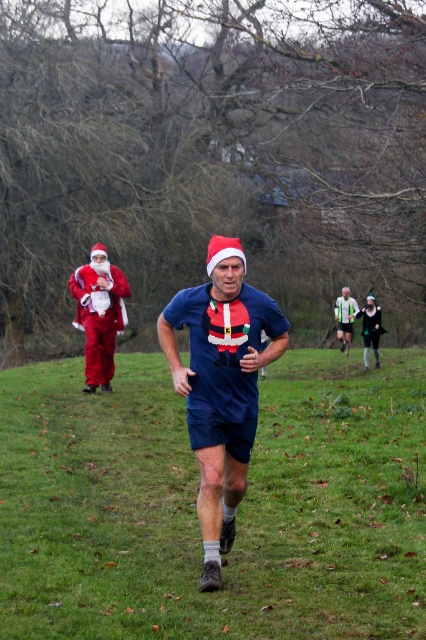
Question: Which object is the closest to the blue fabric shirt at center?

Choices:
 (A) matte white shirt at center
 (B) velvet santa at left

Answer: (B)

Question: Considering the relative positions of green grass at center and velvet santa at left in the image provided, where is green grass at center located with respect to velvet santa at left?

Choices:
 (A) left
 (B) right

Answer: (B)

Question: Does green grass at center have a larger size compared to velvet santa at left?

Choices:
 (A) no
 (B) yes

Answer: (B)

Question: Which of these objects is positioned closest to the blue fabric shirt at center?

Choices:
 (A) velvet santa at left
 (B) matte white shirt at center
 (C) green grass at center

Answer: (C)

Question: Is green grass at center thinner than blue fabric shirt at center?

Choices:
 (A) no
 (B) yes

Answer: (A)

Question: Among these objects, which one is farthest from the camera?

Choices:
 (A) velvet santa at left
 (B) matte white shirt at center
 (C) green grass at center

Answer: (B)